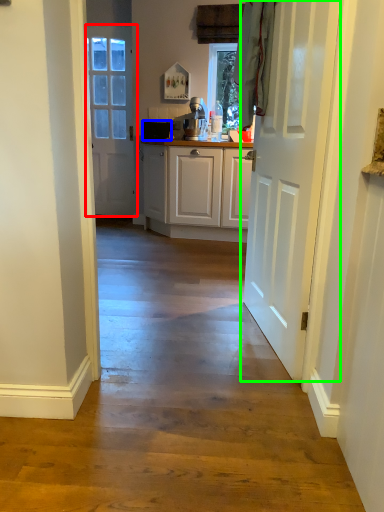
Question: Estimate the real-world distances between objects in this image. Which object is farther from door (highlighted by a red box), appliance (highlighted by a blue box) or door (highlighted by a green box)?

Choices:
 (A) appliance
 (B) door

Answer: (B)